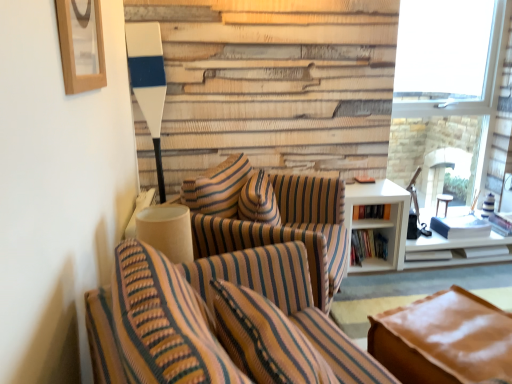
Question: From the image's perspective, is hardcover books at right, which is the second book from bottom to top, beneath striped fabric chair at center, marked as the 2th chair in a front-to-back arrangement?

Choices:
 (A) no
 (B) yes

Answer: (A)

Question: Considering the relative sizes of hardcover books at right, which is the second book from bottom to top, and striped fabric chair at center, marked as the 2th chair in a front-to-back arrangement, in the image provided, is hardcover books at right, which is the second book from bottom to top, wider than striped fabric chair at center, marked as the 2th chair in a front-to-back arrangement,?

Choices:
 (A) yes
 (B) no

Answer: (B)

Question: Is the depth of hardcover books at right, which is the second book from bottom to top, greater than that of striped fabric chair at center, which appears as the first chair when viewed from the back?

Choices:
 (A) no
 (B) yes

Answer: (B)

Question: Is the position of hardcover books at right, the first book in the top-to-bottom sequence, less distant than that of striped fabric chair at center, marked as the 2th chair in a front-to-back arrangement?

Choices:
 (A) yes
 (B) no

Answer: (B)

Question: Does hardcover books at right, which is the second book from bottom to top, appear on the left side of striped fabric chair at center, marked as the 2th chair in a front-to-back arrangement?

Choices:
 (A) yes
 (B) no

Answer: (B)

Question: From a real-world perspective, is wooden picture frame at upper left above or below hardcover books at right, the first book when ordered from bottom to top?

Choices:
 (A) above
 (B) below

Answer: (A)

Question: Is point coord(82,28) positioned closer to the camera than point coord(371,240)?

Choices:
 (A) closer
 (B) farther

Answer: (A)

Question: Considering the positions of wooden picture frame at upper left and hardcover books at right, which is the second book from top to bottom, in the image, is wooden picture frame at upper left wider or thinner than hardcover books at right, which is the second book from top to bottom,?

Choices:
 (A) wide
 (B) thin

Answer: (B)

Question: Considering the positions of wooden picture frame at upper left and hardcover books at right, the first book when ordered from bottom to top, in the image, is wooden picture frame at upper left bigger or smaller than hardcover books at right, the first book when ordered from bottom to top,?

Choices:
 (A) big
 (B) small

Answer: (B)

Question: Considering the relative positions of striped fabric chair at center, which appears as the first chair when viewed from the back, and white matte window at upper right in the image provided, is striped fabric chair at center, which appears as the first chair when viewed from the back, to the left or to the right of white matte window at upper right?

Choices:
 (A) right
 (B) left

Answer: (B)

Question: From a real-world perspective, is striped fabric chair at center, which appears as the first chair when viewed from the back, positioned above or below white matte window at upper right?

Choices:
 (A) below
 (B) above

Answer: (A)

Question: Is point (234, 165) closer or farther from the camera than point (507, 3)?

Choices:
 (A) farther
 (B) closer

Answer: (B)

Question: From the image's perspective, is striped fabric chair at center, which appears as the first chair when viewed from the back, above or below white matte window at upper right?

Choices:
 (A) below
 (B) above

Answer: (A)

Question: Considering the relative positions of striped fabric chair at center, marked as the 2th chair in a front-to-back arrangement, and hardcover books at right, which is the second book from top to bottom, in the image provided, is striped fabric chair at center, marked as the 2th chair in a front-to-back arrangement, to the left or to the right of hardcover books at right, which is the second book from top to bottom,?

Choices:
 (A) right
 (B) left

Answer: (B)

Question: Considering the positions of striped fabric chair at center, which appears as the first chair when viewed from the back, and hardcover books at right, which is the second book from top to bottom, in the image, is striped fabric chair at center, which appears as the first chair when viewed from the back, bigger or smaller than hardcover books at right, which is the second book from top to bottom,?

Choices:
 (A) big
 (B) small

Answer: (A)